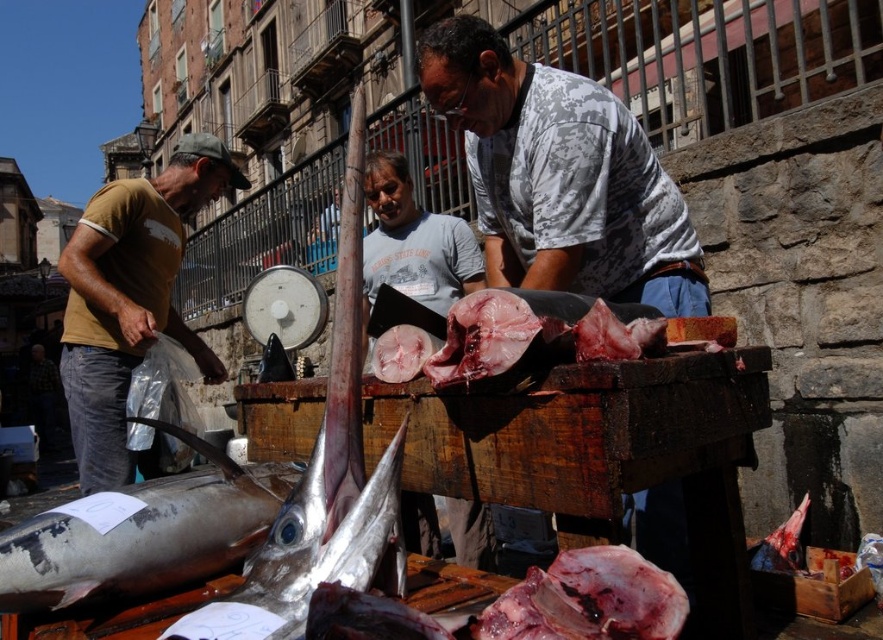
Question: Is yellow t-shirt at left below dark red flesh at center?

Choices:
 (A) yes
 (B) no

Answer: (B)

Question: Which object is positioned farthest from the silver metallic fish at lower left?

Choices:
 (A) dark red flesh at center
 (B) yellow t-shirt at left

Answer: (B)

Question: Does silver metallic fish at lower left lie in front of dark red flesh at center?

Choices:
 (A) yes
 (B) no

Answer: (B)

Question: Which point appears farthest from the camera in this image?

Choices:
 (A) coord(600,570)
 (B) coord(104,241)

Answer: (B)

Question: Which point is farther from the camera taking this photo?

Choices:
 (A) (119, 442)
 (B) (140, 541)

Answer: (A)

Question: In this image, where is yellow t-shirt at left located relative to dark red flesh at center?

Choices:
 (A) right
 (B) left

Answer: (B)